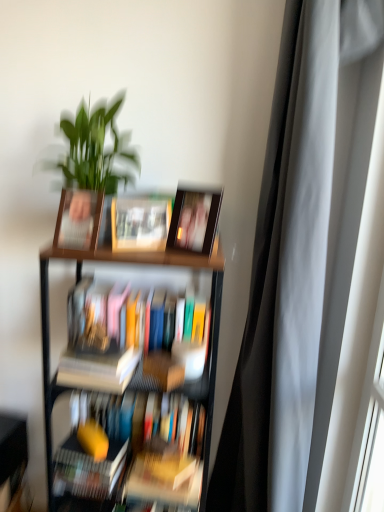
Question: Is matte wooden photo frame at center, which is the 4th book in bottom-to-top order, bigger or smaller than matte wooden picture frame at upper center, placed as the second picture frame when sorted from left to right?

Choices:
 (A) small
 (B) big

Answer: (A)

Question: Considering their positions, is matte wooden photo frame at center, which is counted as the first book, starting from the top, located in front of or behind matte wooden picture frame at upper center, placed as the second picture frame when sorted from left to right?

Choices:
 (A) behind
 (B) front

Answer: (A)

Question: Based on their relative distances, which object is nearer to the matte plastic picture frame at upper left, which is counted as the 2th picture frame, starting from the right?

Choices:
 (A) wooden bookshelf at lower left
 (B) green glossy plant at upper left
 (C) matte wooden photo frame at center, which is the 4th book in bottom-to-top order
 (D) silky gray curtain at right
 (E) wooden bookcase at center

Answer: (B)

Question: Which object is the farthest from the green glossy plant at upper left?

Choices:
 (A) matte wooden photo frame at center, which is the 4th book in bottom-to-top order
 (B) matte plastic picture frame at upper left, marked as the 1th picture frame in a left-to-right arrangement
 (C) wooden bookcase at center
 (D) hardcover book at lower left, the 4th book from the top
 (E) wooden bookshelf at lower left

Answer: (E)